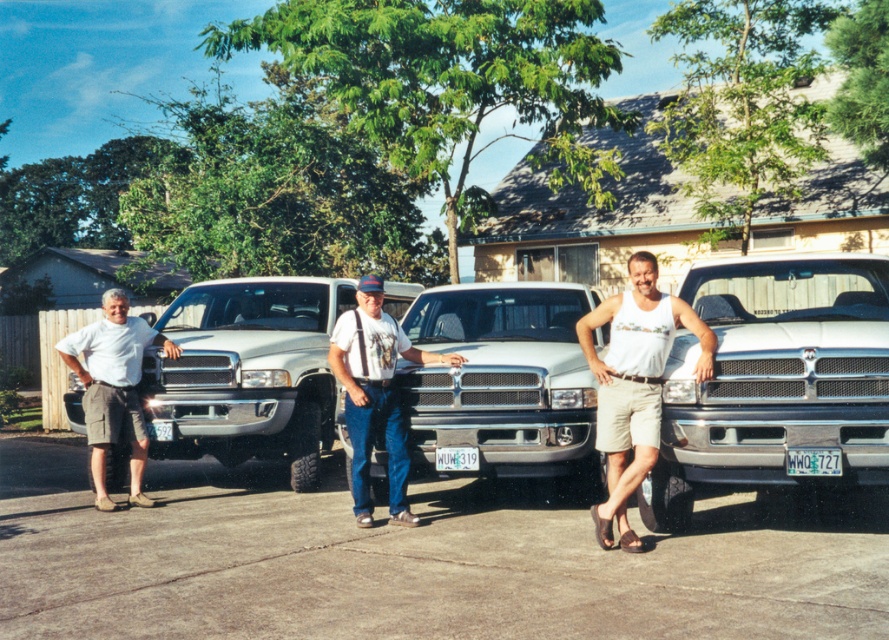
Is matte silver pickup truck at center taller than denim pants at center?

No.

Who is positioned more to the right, matte silver pickup truck at center or denim pants at center?

From the viewer's perspective, matte silver pickup truck at center appears more on the right side.

Who is more distant from viewer, (463, 426) or (378, 353)?

The point (378, 353) is behind.

You are a GUI agent. You are given a task and a screenshot of the screen. Output one action in this format:
    pyautogui.click(x=<x>, y=<y>)
    Task: Click on the matte silver pickup truck at center
    Image resolution: width=889 pixels, height=640 pixels.
    Given the screenshot: What is the action you would take?
    pyautogui.click(x=502, y=380)

Does white matte truck at center appear on the right side of light gray cotton shorts at left?

Correct, you'll find white matte truck at center to the right of light gray cotton shorts at left.

Does white matte truck at center have a greater height compared to light gray cotton shorts at left?

In fact, white matte truck at center may be shorter than light gray cotton shorts at left.

Does point (582, 392) lie in front of point (121, 408)?

Yes, point (582, 392) is closer to viewer.

Where is `white matte truck at center`? The image size is (889, 640). white matte truck at center is located at coordinates (549, 378).

Which is behind, point (589, 397) or point (357, 508)?

Positioned behind is point (357, 508).

Can you confirm if white matte truck at center is positioned to the left of denim pants at center?

No, white matte truck at center is not to the left of denim pants at center.

Who is more forward, (454, 456) or (370, 404)?

Point (370, 404) is in front.

Identify the location of white matte truck at center. pyautogui.click(x=549, y=378).